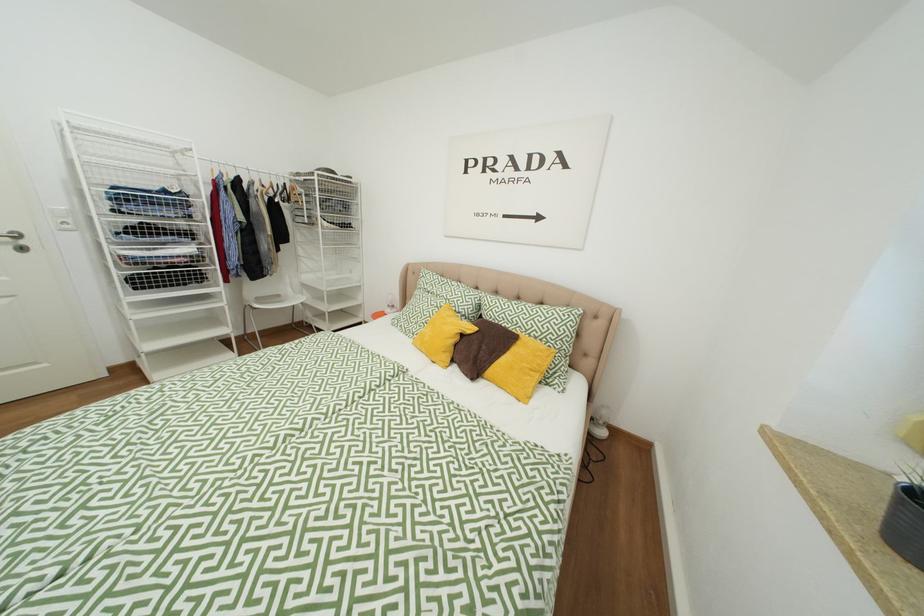
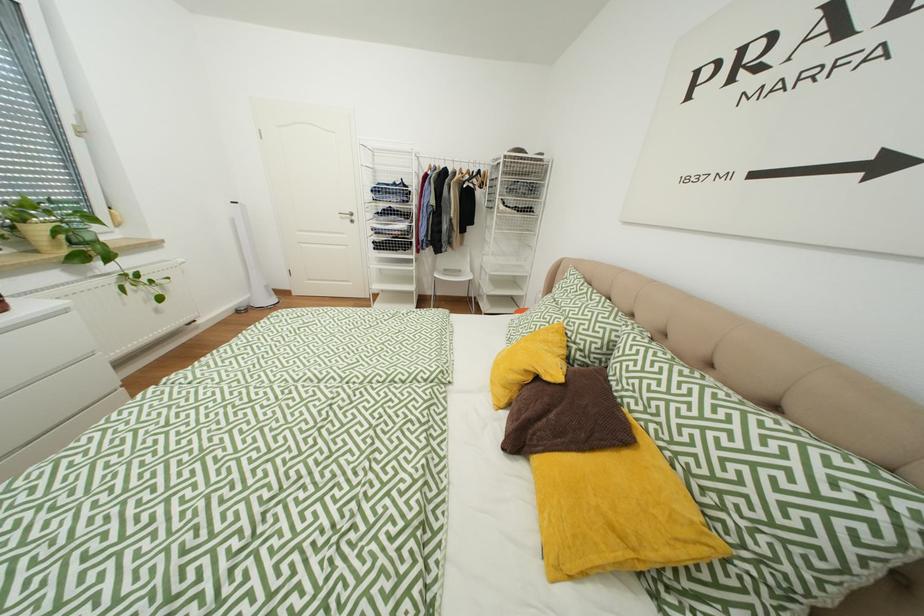
Question: The camera is either moving clockwise (left) or counter-clockwise (right) around the object. The first image is from the beginning of the video and the second image is from the end. Is the camera moving left or right when shooting the video?

Choices:
 (A) Left
 (B) Right

Answer: (B)